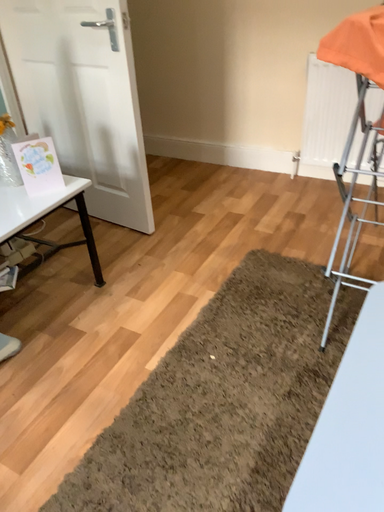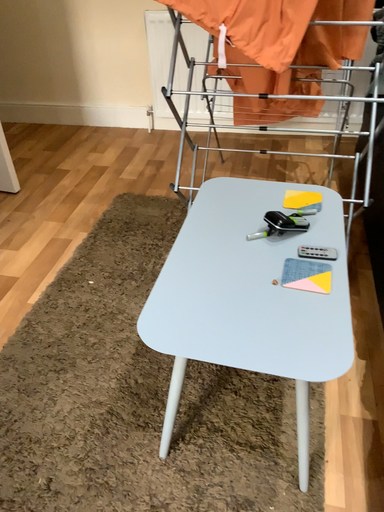
Question: How did the camera likely rotate when shooting the video?

Choices:
 (A) rotated right
 (B) rotated left

Answer: (A)